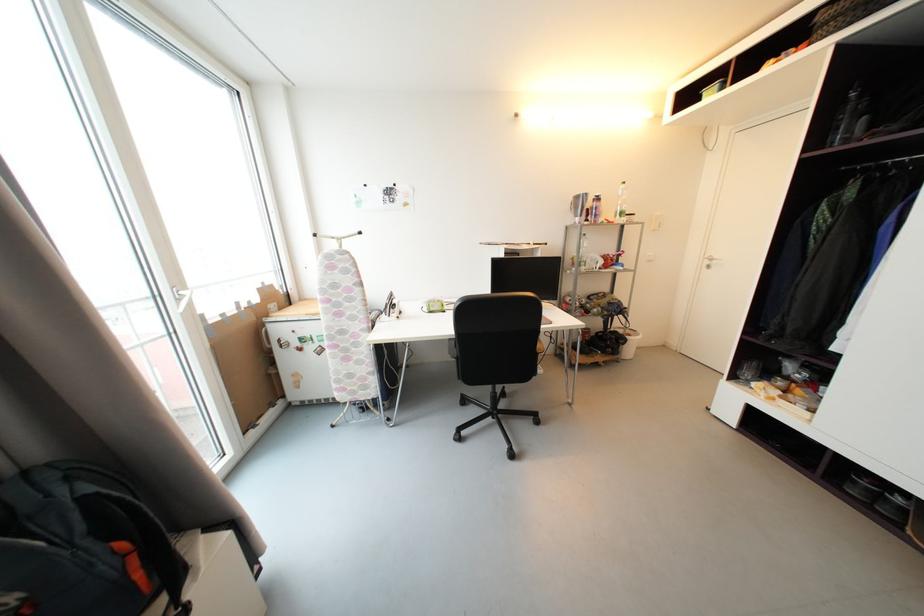
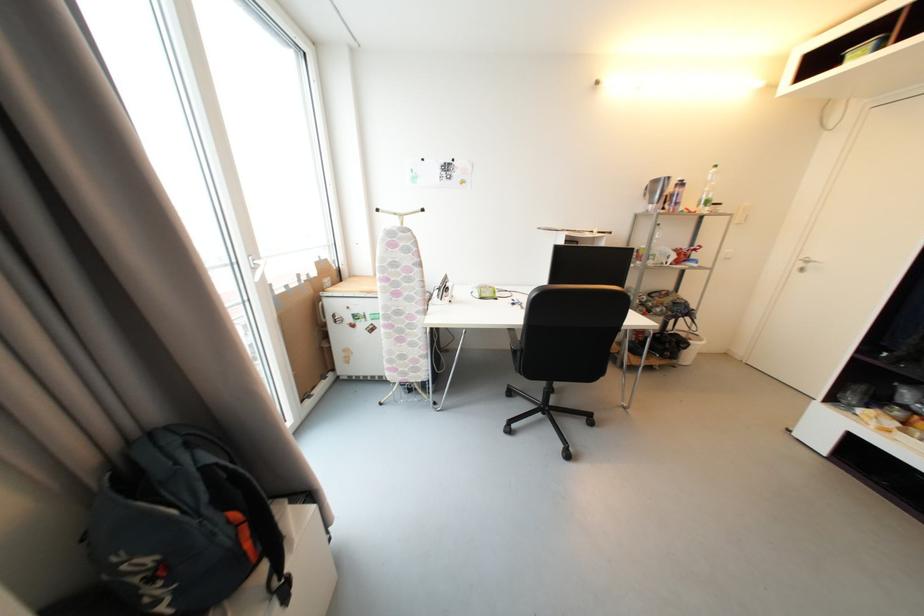
Locate, in the second image, the point that corresponds to point (143, 577) in the first image.

(253, 546)